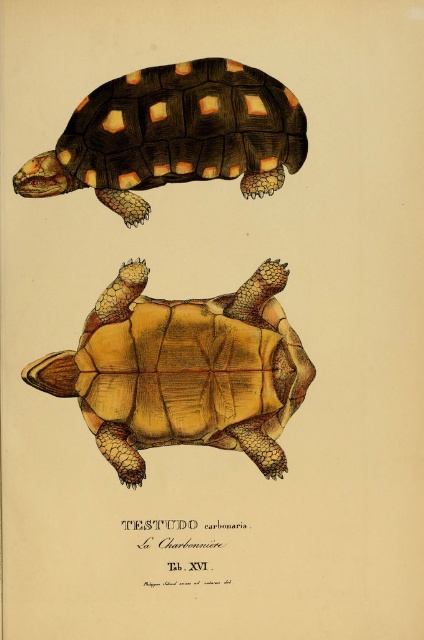
Can you confirm if yellow matte shell at center is positioned above matte orange shell at upper left?

Actually, yellow matte shell at center is below matte orange shell at upper left.

Locate an element on the screen. The width and height of the screenshot is (424, 640). yellow matte shell at center is located at coordinates (184, 371).

Which is in front, point (109, 432) or point (38, 156)?

Positioned in front is point (38, 156).

Image resolution: width=424 pixels, height=640 pixels. What are the coordinates of `yellow matte shell at center` in the screenshot? It's located at (184, 371).